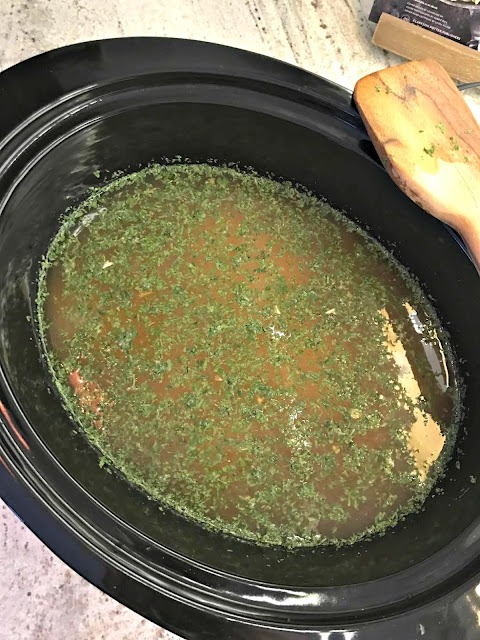
Locate an element on the screen. Image resolution: width=480 pixels, height=640 pixels. black inside of pot is located at coordinates (102, 466).